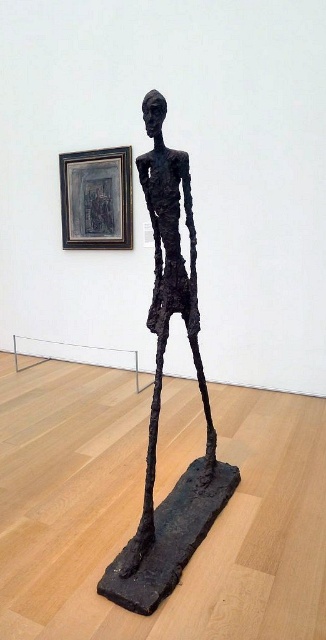
Question: Does rusty metal figure at center appear on the left side of matte black frame at upper left?

Choices:
 (A) yes
 (B) no

Answer: (B)

Question: Is the position of rusty metal figure at center more distant than that of matte black frame at upper left?

Choices:
 (A) yes
 (B) no

Answer: (B)

Question: Is rusty metal figure at center to the right of matte black frame at upper left from the viewer's perspective?

Choices:
 (A) no
 (B) yes

Answer: (B)